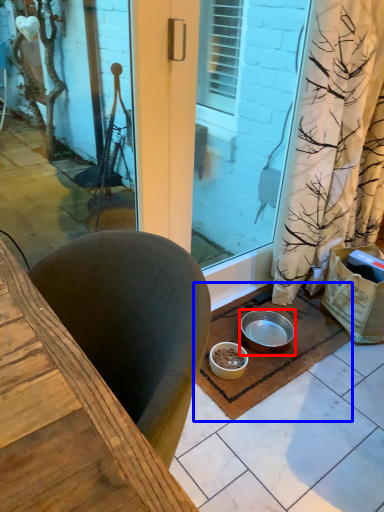
Question: Which object appears farthest to the camera in this image, bowl (highlighted by a red box) or doormat (highlighted by a blue box)?

Choices:
 (A) bowl
 (B) doormat

Answer: (A)